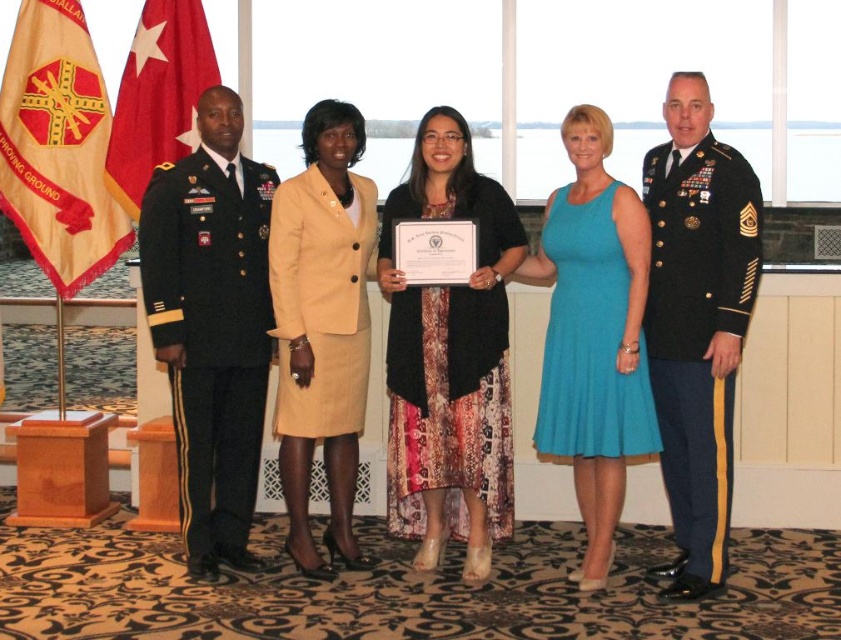
Question: Is green military uniform at left positioned behind shiny black uniform at right?

Choices:
 (A) yes
 (B) no

Answer: (A)

Question: Is black matte dress at center closer to camera compared to beige fabric skirt at center?

Choices:
 (A) no
 (B) yes

Answer: (B)

Question: From the image, what is the correct spatial relationship of black matte dress at center in relation to beige fabric skirt at center?

Choices:
 (A) above
 (B) below

Answer: (B)

Question: Among these points, which one is farthest from the camera?

Choices:
 (A) (204, 461)
 (B) (29, 12)
 (C) (662, 250)
 (D) (201, 90)

Answer: (D)

Question: Which of these objects is positioned closest to the beige fabric skirt at center?

Choices:
 (A) green military uniform at left
 (B) gold/yellow fabric flag at left
 (C) shiny black uniform at right

Answer: (A)

Question: Which point is closer to the camera?

Choices:
 (A) beige fabric skirt at center
 (B) gold/yellow fabric flag at left

Answer: (A)